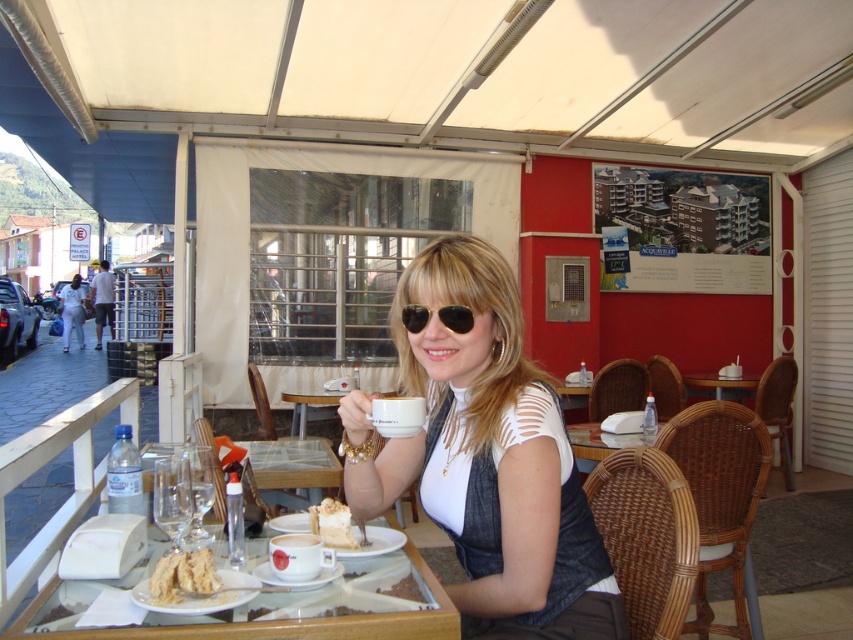
Question: Does light brown creamy cake at lower center have a greater width compared to wooden table at center?

Choices:
 (A) yes
 (B) no

Answer: (B)

Question: Is white matte shirt at center below light brown creamy cake at lower center?

Choices:
 (A) yes
 (B) no

Answer: (B)

Question: Among these points, which one is nearest to the camera?

Choices:
 (A) (177, 563)
 (B) (370, 577)

Answer: (A)

Question: Among these points, which one is nearest to the camera?

Choices:
 (A) (741, 380)
 (B) (202, 561)
 (C) (463, 408)
 (D) (329, 528)

Answer: (B)

Question: Is white matte shirt at center to the right of black aviator sunglasses at center from the viewer's perspective?

Choices:
 (A) no
 (B) yes

Answer: (B)

Question: Considering the real-world distances, which object is farthest from the light brown creamy cake at lower center?

Choices:
 (A) wooden table at center
 (B) black aviator sunglasses at center
 (C) golden crumbly cake at lower left

Answer: (A)